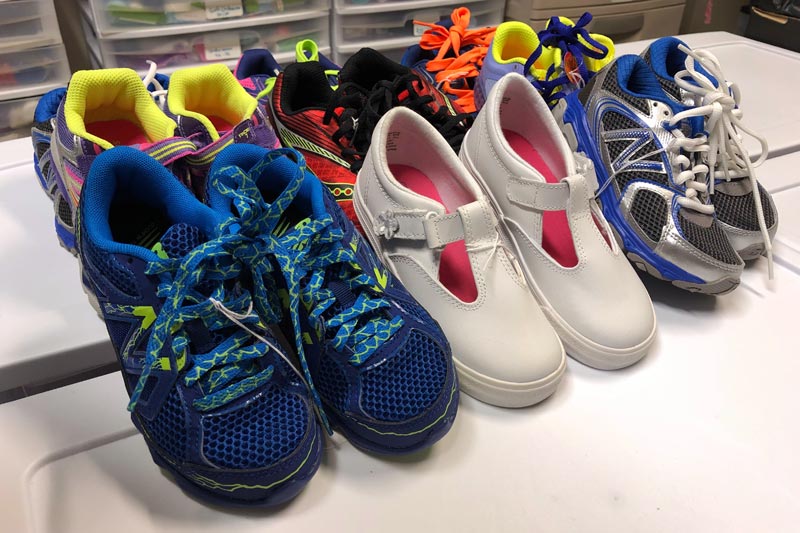
Where is `pairs of shoes`? pairs of shoes is located at coordinates (256, 272), (518, 256), (696, 182), (196, 135), (362, 104), (566, 63), (454, 64).